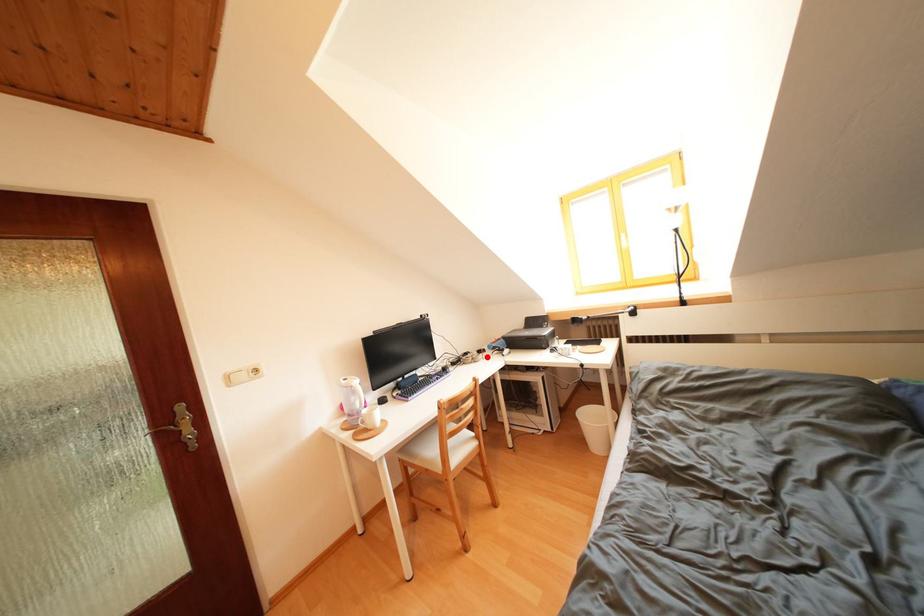
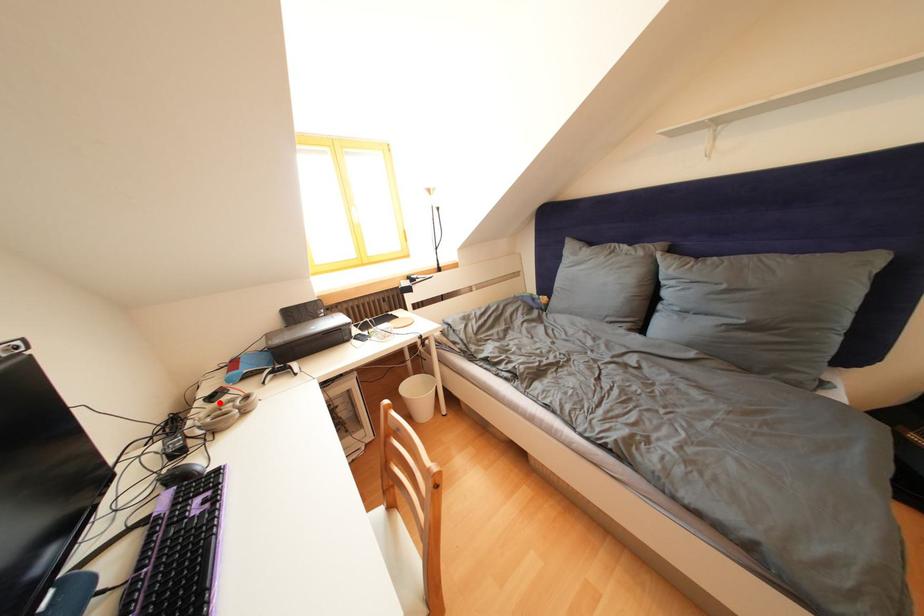
I am providing you with two images of the same scene from different viewpoints. A red point is marked on the first image and another point is marked on the second image. Is the marked point in image1 the same physical position as the marked point in image2?

Yes